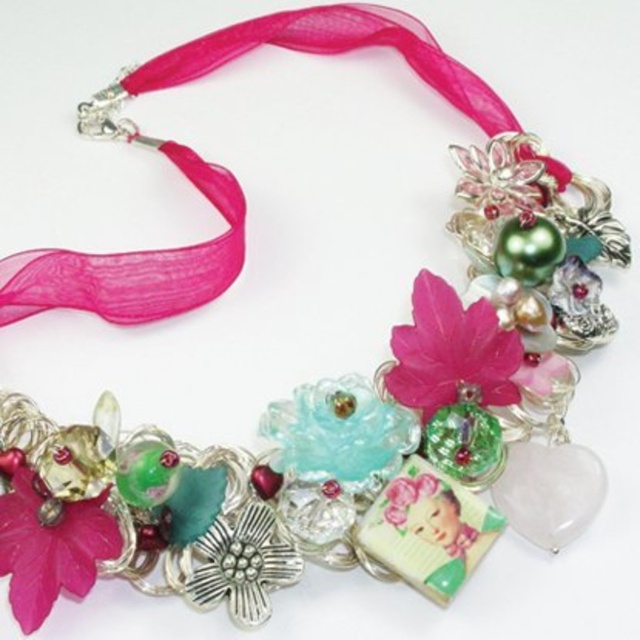
Who is lower down, translucent green flower at center or pink glossy flower at center?

Positioned lower is translucent green flower at center.

Does translucent green flower at center appear under pink glossy flower at center?

Yes, translucent green flower at center is below pink glossy flower at center.

Is point (20, 589) closer to viewer compared to point (452, 150)?

Yes, it is.

This screenshot has height=640, width=640. I want to click on translucent green flower at center, so click(49, 548).

From the picture: Can you confirm if matte pink flower at center is shorter than pink glossy flower at center?

Incorrect, matte pink flower at center's height does not fall short of pink glossy flower at center's.

Between point (442, 317) and point (516, 163), which one is positioned behind?

Positioned behind is point (516, 163).

Locate an element on the screen. This screenshot has width=640, height=640. matte pink flower at center is located at coordinates (451, 352).

Does translucent green flower at center lie behind translucent plastic flower at center?

No, it is not.

Looking at this image, who is positioned more to the left, translucent green flower at center or translucent plastic flower at center?

translucent green flower at center is more to the left.

This screenshot has width=640, height=640. I want to click on translucent green flower at center, so click(49, 548).